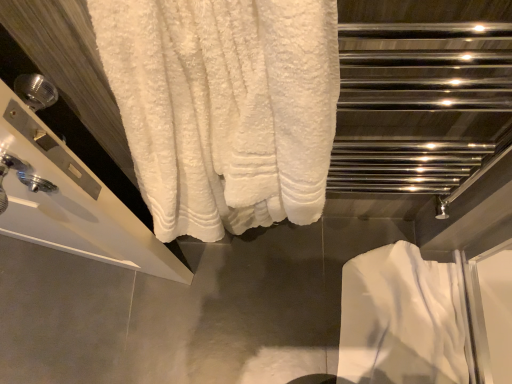
Question: Is white fluffy towel at upper left shorter than white soft towel at lower right?

Choices:
 (A) yes
 (B) no

Answer: (B)

Question: Is white fluffy towel at upper left oriented towards white soft towel at lower right?

Choices:
 (A) no
 (B) yes

Answer: (A)

Question: Considering the relative sizes of white fluffy towel at upper left and white soft towel at lower right in the image provided, is white fluffy towel at upper left taller than white soft towel at lower right?

Choices:
 (A) yes
 (B) no

Answer: (A)

Question: Is white fluffy towel at upper left surrounding white soft towel at lower right?

Choices:
 (A) yes
 (B) no

Answer: (B)

Question: Is white fluffy towel at upper left with white soft towel at lower right?

Choices:
 (A) yes
 (B) no

Answer: (B)

Question: Is white soft towel at lower right at the back of white fluffy towel at upper left?

Choices:
 (A) yes
 (B) no

Answer: (B)

Question: From the image's perspective, is white soft towel at lower right beneath white fluffy towel at upper left?

Choices:
 (A) yes
 (B) no

Answer: (A)

Question: Is white soft towel at lower right aimed at white fluffy towel at upper left?

Choices:
 (A) no
 (B) yes

Answer: (A)

Question: Can you confirm if white soft towel at lower right is positioned to the right of white fluffy towel at upper left?

Choices:
 (A) yes
 (B) no

Answer: (A)

Question: Does white soft towel at lower right have a lesser width compared to white fluffy towel at upper left?

Choices:
 (A) no
 (B) yes

Answer: (A)

Question: Considering the relative sizes of white soft towel at lower right and white fluffy towel at upper left in the image provided, is white soft towel at lower right taller than white fluffy towel at upper left?

Choices:
 (A) yes
 (B) no

Answer: (B)

Question: From a real-world perspective, is white soft towel at lower right below white fluffy towel at upper left?

Choices:
 (A) yes
 (B) no

Answer: (A)

Question: From the image's perspective, is white soft towel at lower right located above or below white fluffy towel at upper left?

Choices:
 (A) above
 (B) below

Answer: (B)